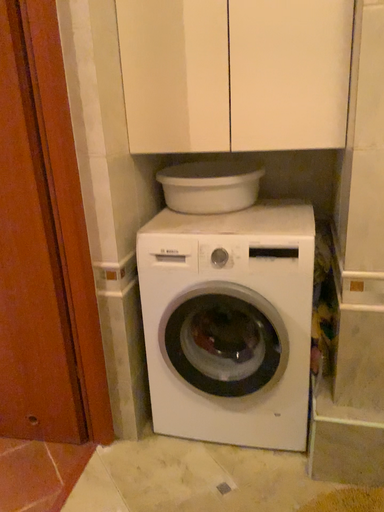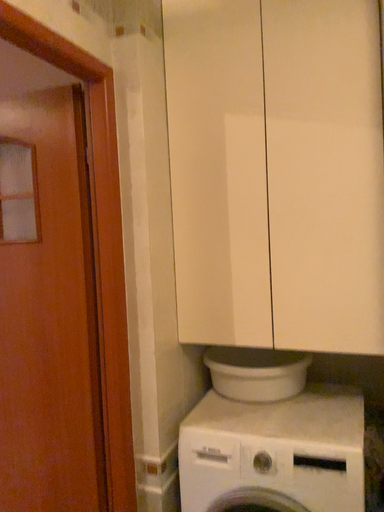
Question: How did the camera likely rotate when shooting the video?

Choices:
 (A) rotated upward
 (B) rotated downward

Answer: (A)